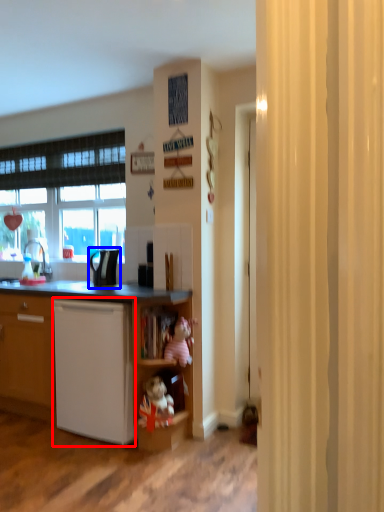
Question: Which point is closer to the camera, dish washer (highlighted by a red box) or appliance (highlighted by a blue box)?

Choices:
 (A) dish washer
 (B) appliance

Answer: (A)